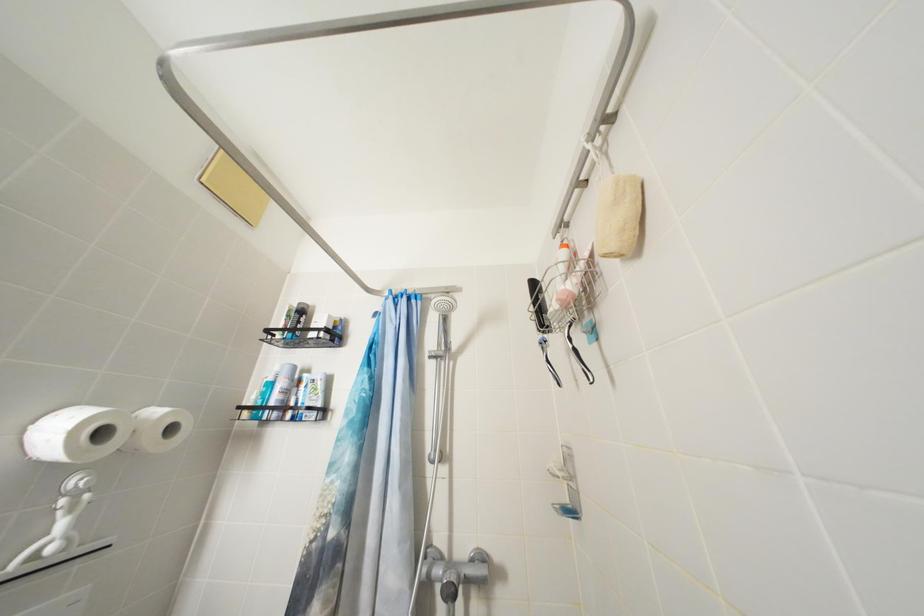
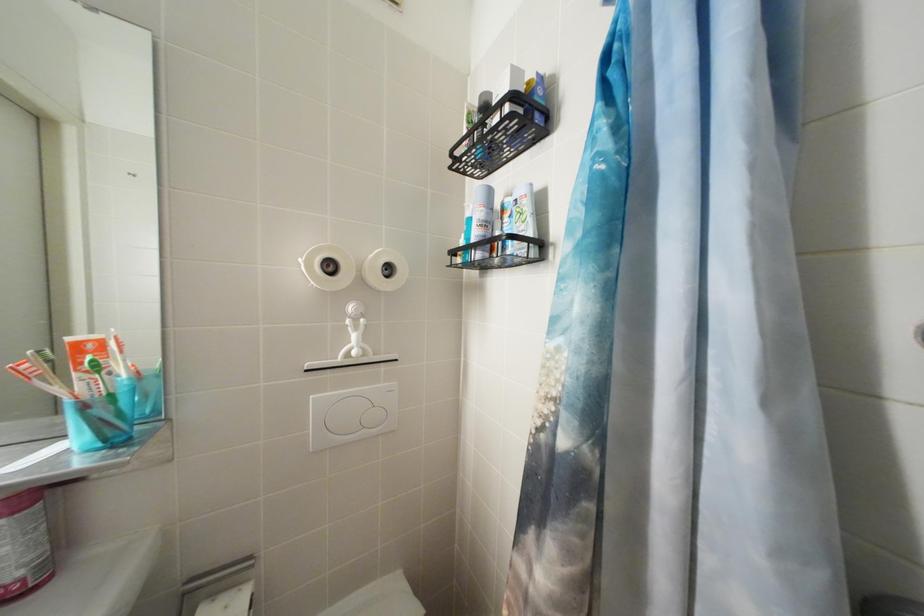
The images are taken continuously from a first-person perspective. In which direction is your viewpoint rotating?

The camera's rotation is toward left-down.